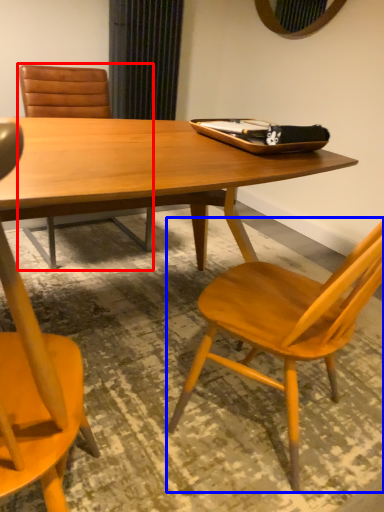
Question: Which point is further to the camera, chair (highlighted by a red box) or chair (highlighted by a blue box)?

Choices:
 (A) chair
 (B) chair

Answer: (A)